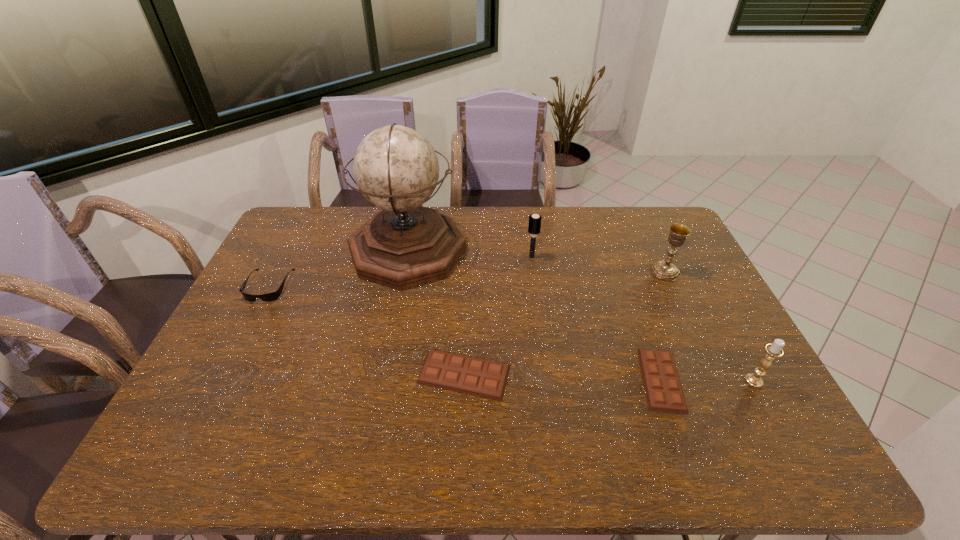
Find the location of `vacant space situated on the left of the sixth tallest object`. vacant space situated on the left of the sixth tallest object is located at coordinates (348, 374).

Locate an element on the screen. Image resolution: width=960 pixels, height=540 pixels. vacant space located on the left of the shortest object is located at coordinates (597, 380).

Image resolution: width=960 pixels, height=540 pixels. I want to click on blank area located on the front of the fourth object from left to right, so click(x=537, y=292).

The width and height of the screenshot is (960, 540). In order to click on free space located 0.090m on the surface of the globe in this screenshot , I will do `click(492, 251)`.

Locate an element on the screen. The width and height of the screenshot is (960, 540). free space located on the front-facing side of the leftmost object is located at coordinates (223, 374).

Locate an element on the screen. The width and height of the screenshot is (960, 540). free location located on the left of the chalice is located at coordinates (611, 271).

You are a GUI agent. You are given a task and a screenshot of the screen. Output one action in this format:
    pyautogui.click(x=<x>, y=<y>)
    Task: Click on the vacant space located on the back of the rightmost object
    This screenshot has height=540, width=960.
    Given the screenshot: What is the action you would take?
    pyautogui.click(x=702, y=285)

Find the location of a particular element. object present at the far edge is located at coordinates (403, 245).

The height and width of the screenshot is (540, 960). What are the coordinates of `object situated at the left edge` in the screenshot? It's located at (272, 296).

Locate an element on the screen. chalice at the right edge is located at coordinates (666, 270).